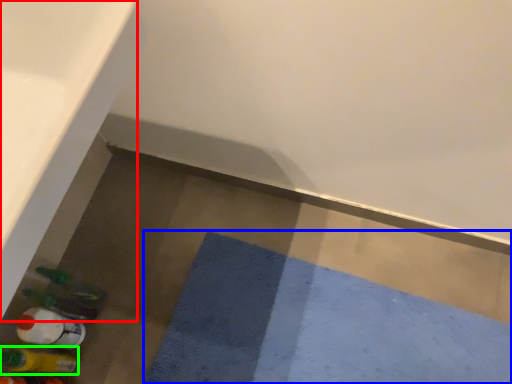
Question: Which is nearer to the bath (highlighted by a red box)? bath mat (highlighted by a blue box) or bottle (highlighted by a green box).

Choices:
 (A) bath mat
 (B) bottle

Answer: (B)